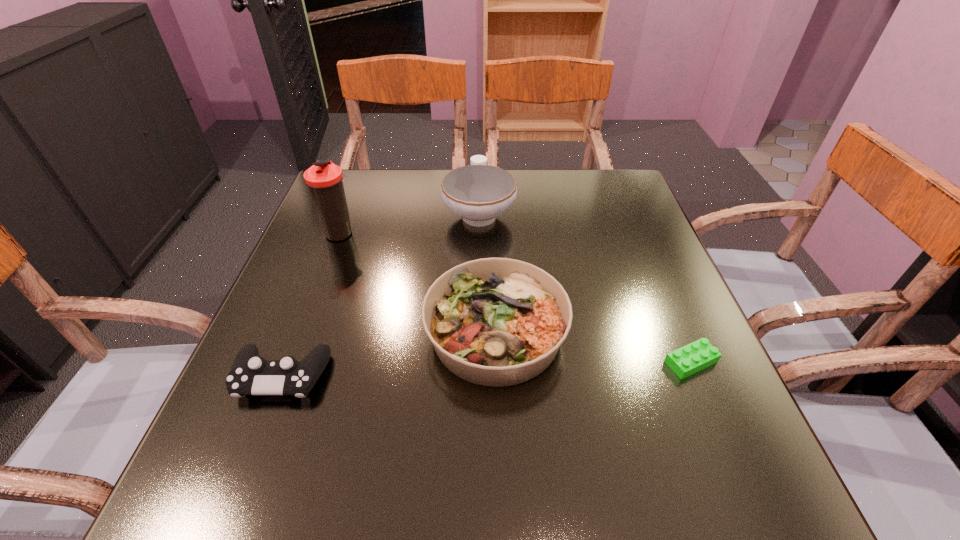
Where is `vacant space located 0.080m on the left of the rightmost object`? The height and width of the screenshot is (540, 960). vacant space located 0.080m on the left of the rightmost object is located at coordinates (619, 362).

You are a GUI agent. You are given a task and a screenshot of the screen. Output one action in this format:
    pyautogui.click(x=<x>, y=<y>)
    Task: Click on the object at the far edge
    
    Given the screenshot: What is the action you would take?
    pyautogui.click(x=478, y=193)

This screenshot has height=540, width=960. I want to click on thermos bottle located in the left edge section of the desktop, so click(x=325, y=179).

Locate an element on the screen. The height and width of the screenshot is (540, 960). control that is at the left edge is located at coordinates (251, 374).

Image resolution: width=960 pixels, height=540 pixels. In order to click on object located in the right edge section of the desktop in this screenshot , I will do `click(696, 356)`.

In the image, there is a desktop. At what (x,y) coordinates should I click in order to perform the action: click on vacant space at the far edge. Please return your answer as a coordinate pair (x, y). Looking at the image, I should click on (411, 193).

In the image, there is a desktop. At what (x,y) coordinates should I click in order to perform the action: click on vacant space at the left edge. Please return your answer as a coordinate pair (x, y). The height and width of the screenshot is (540, 960). Looking at the image, I should click on (320, 228).

The width and height of the screenshot is (960, 540). In order to click on free space at the right edge of the desktop in this screenshot , I will do `click(654, 267)`.

You are a GUI agent. You are given a task and a screenshot of the screen. Output one action in this format:
    pyautogui.click(x=<x>, y=<y>)
    Task: Click on the free region at the near left corner of the desktop
    This screenshot has height=540, width=960.
    Given the screenshot: What is the action you would take?
    pyautogui.click(x=276, y=452)

You are a GUI agent. You are given a task and a screenshot of the screen. Output one action in this format:
    pyautogui.click(x=<x>, y=<y>)
    Task: Click on the free space at the far right corner
    The height and width of the screenshot is (540, 960).
    Given the screenshot: What is the action you would take?
    pyautogui.click(x=623, y=174)